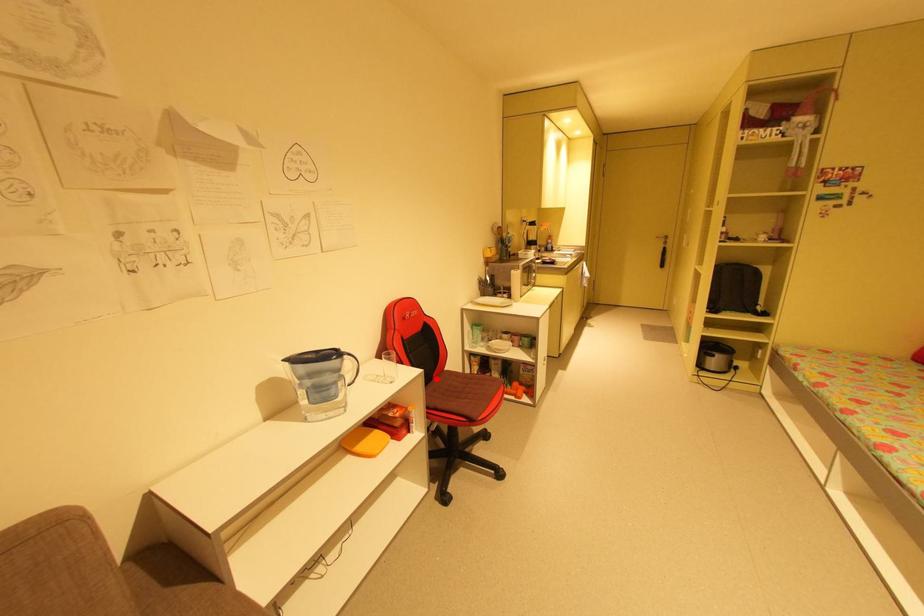
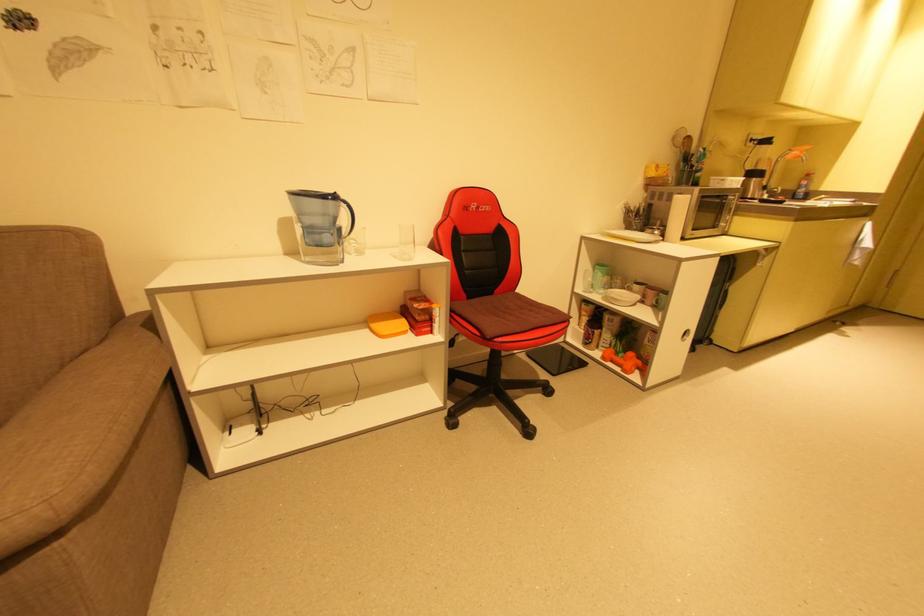
In the second image, find the point that corresponds to the highlighted location in the first image.

(495, 294)